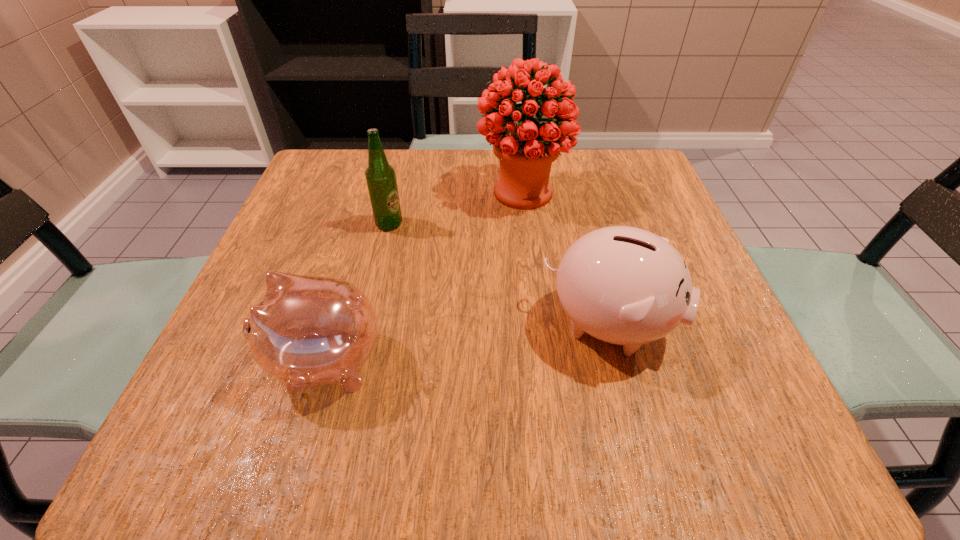
I want to click on object that is at the left edge, so click(307, 331).

Identify the location of object at the right edge. The image size is (960, 540). (623, 285).

The image size is (960, 540). I want to click on object that is positioned at the near left corner, so click(307, 331).

In the image, there is a desktop. In order to click on blank space at the far edge in this screenshot , I will do `click(398, 164)`.

Identify the location of free spot at the near edge of the desktop. This screenshot has height=540, width=960. (632, 418).

Locate an element on the screen. This screenshot has width=960, height=540. vacant space at the left edge of the desktop is located at coordinates (274, 247).

Locate an element on the screen. This screenshot has width=960, height=540. blank area at the right edge is located at coordinates (669, 344).

Identify the location of free point at the far left corner. The image size is (960, 540). (319, 180).

In order to click on vacant space at the near left corner of the desktop in this screenshot , I will do `click(206, 407)`.

At what (x,y) coordinates should I click in order to perform the action: click on blank space at the far right corner of the desktop. Please return your answer as a coordinate pair (x, y). The width and height of the screenshot is (960, 540). Looking at the image, I should click on (662, 203).